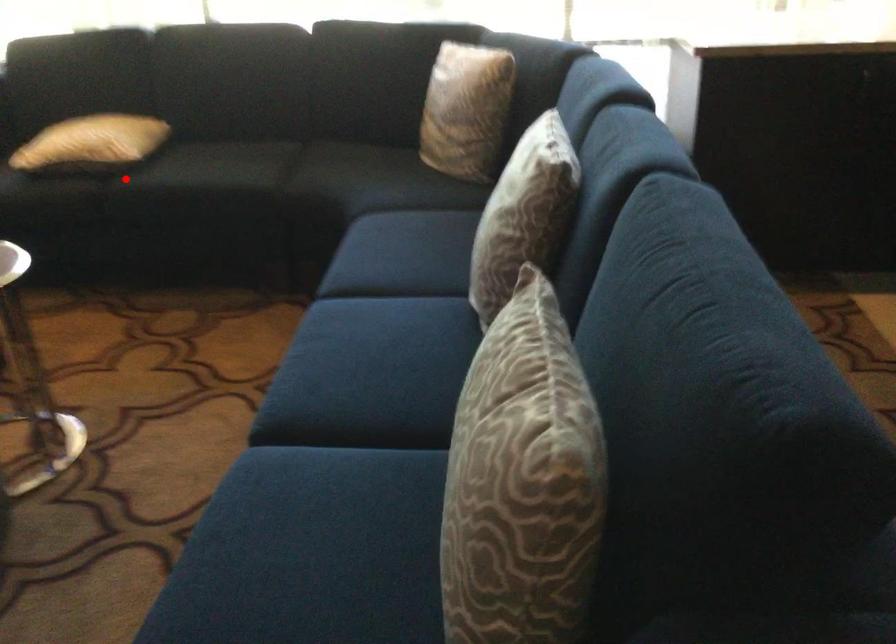
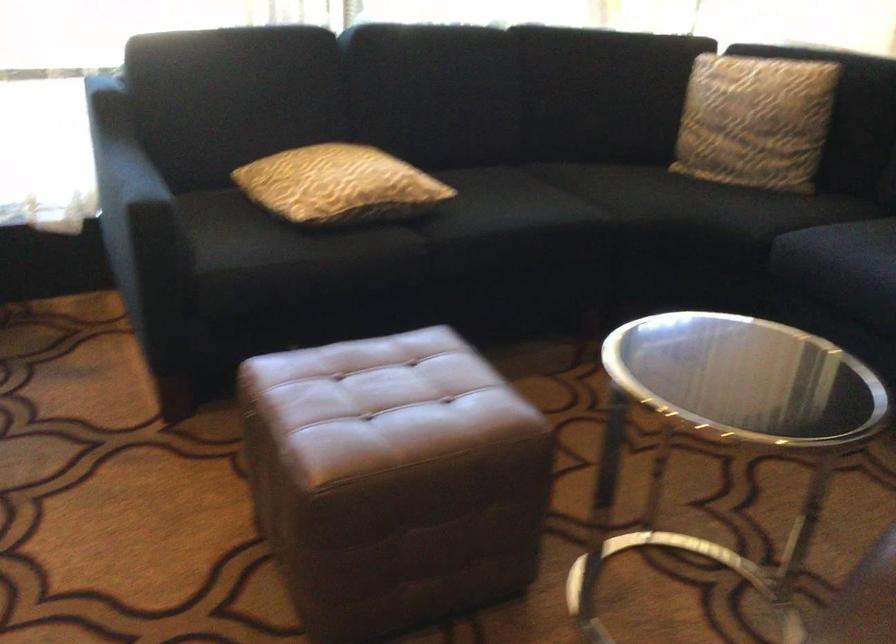
Locate, in the second image, the point that corresponds to the highlighted location in the first image.

(426, 227)